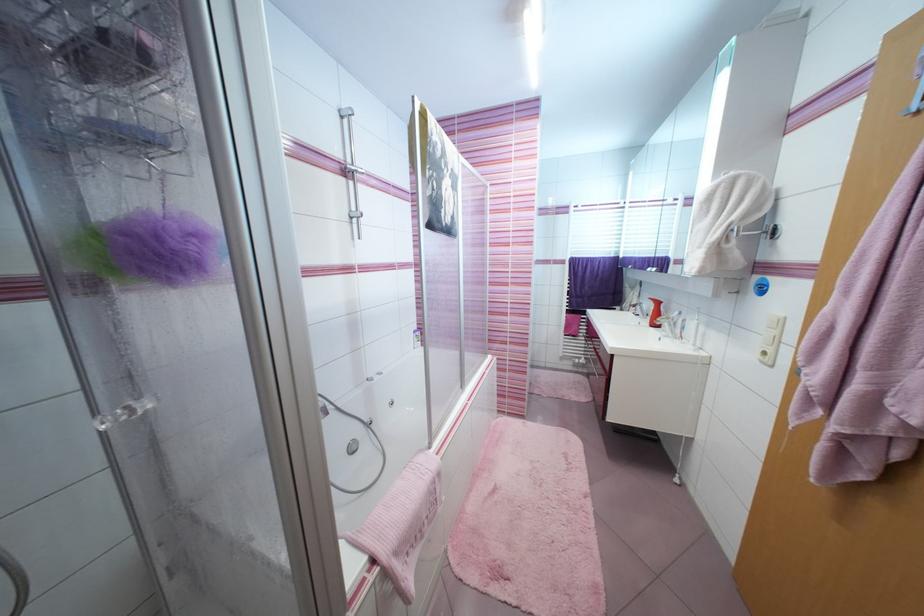
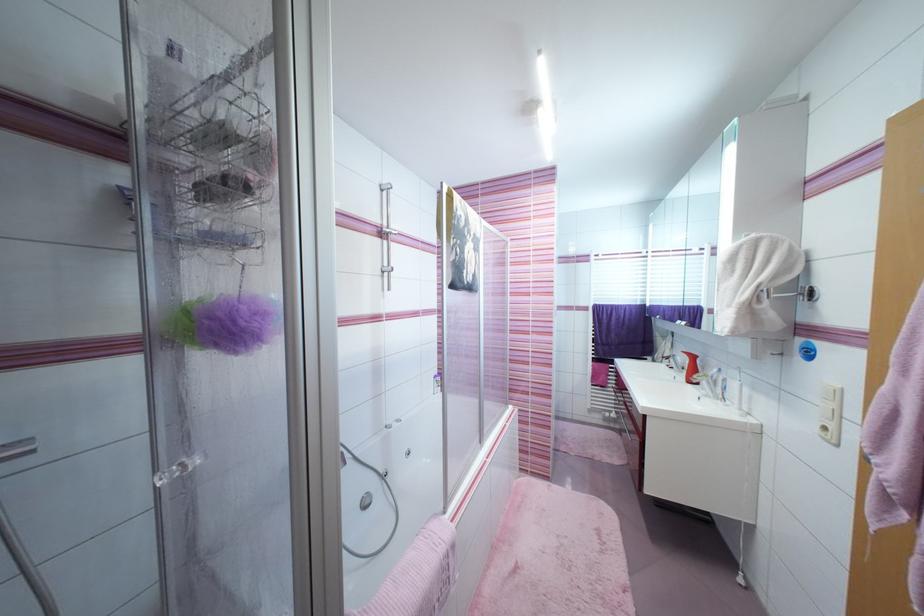
Locate, in the second image, the point that corresponds to the point at 704,249 in the first image.

(735, 307)